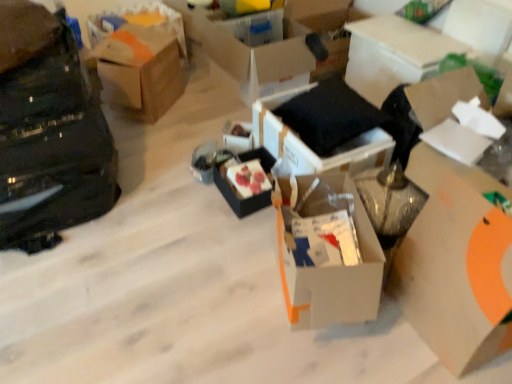
What do you see at coordinates (259, 54) in the screenshot?
I see `white cardboard box at upper center, which is the 3th box in left-to-right order` at bounding box center [259, 54].

The image size is (512, 384). In order to click on white cardboard box at upper center, the second box viewed from the right in this screenshot , I will do `click(393, 54)`.

How much space does brown cardboard box at upper left, positioned as the first box in left-to-right order, occupy horizontally?

It is 13.76 inches.

Identify the location of white cardboard box at center, the fifth box positioned from the right. This screenshot has width=512, height=384. (327, 252).

This screenshot has width=512, height=384. What do you see at coordinates (48, 132) in the screenshot?
I see `black matte bag at left` at bounding box center [48, 132].

The width and height of the screenshot is (512, 384). What are the coordinates of `white cardboard box at center, arranged as the 2th storage box when viewed from the back` in the screenshot? It's located at (237, 136).

From the image's perspective, is white cardboard box at center, the fifth box positioned from the right, on white cardboard box at center, which is the 2th storage box from front to back?

Actually, white cardboard box at center, the fifth box positioned from the right, appears below white cardboard box at center, which is the 2th storage box from front to back, in the image.

Considering the sizes of white cardboard box at center, which ranks as the fourth box in left-to-right order, and white cardboard box at center, the 3th storage box when ordered from top to bottom, in the image, is white cardboard box at center, which ranks as the fourth box in left-to-right order, wider or thinner than white cardboard box at center, the 3th storage box when ordered from top to bottom,?

Clearly, white cardboard box at center, which ranks as the fourth box in left-to-right order, has more width compared to white cardboard box at center, the 3th storage box when ordered from top to bottom.

Which is closer, (300,254) or (236,127)?

The point (300,254) is closer.

Would you say white cardboard box at upper right, which ranks as the eighth box in left-to-right order, is inside or outside black matte box at center, acting as the second box starting from the left?

white cardboard box at upper right, which ranks as the eighth box in left-to-right order, is spatially situated outside black matte box at center, acting as the second box starting from the left.

Considering the sizes of white cardboard box at upper right, which ranks as the eighth box in left-to-right order, and black matte box at center, acting as the second box starting from the left, in the image, is white cardboard box at upper right, which ranks as the eighth box in left-to-right order, taller or shorter than black matte box at center, acting as the second box starting from the left,?

Considering their sizes, white cardboard box at upper right, which ranks as the eighth box in left-to-right order, has more height than black matte box at center, acting as the second box starting from the left.

Is white cardboard box at upper right, which appears as the 1th box when viewed from the right, beside black matte box at center, acting as the second box starting from the left?

No, white cardboard box at upper right, which appears as the 1th box when viewed from the right, is not with black matte box at center, acting as the second box starting from the left.

Looking at this image, can you confirm if white cardboard box at upper right, which ranks as the third storage box in left-to-right order, is thinner than white cardboard box at center, which is the 1th storage box from bottom to top?

Indeed, white cardboard box at upper right, which ranks as the third storage box in left-to-right order, has a lesser width compared to white cardboard box at center, which is the 1th storage box from bottom to top.

Is white cardboard box at upper right, the 2th storage box positioned from the bottom, to the right of white cardboard box at center, which is the 1th storage box from bottom to top, from the viewer's perspective?

Correct, you'll find white cardboard box at upper right, the 2th storage box positioned from the bottom, to the right of white cardboard box at center, which is the 1th storage box from bottom to top.

Is white cardboard box at upper right, the 2th storage box positioned from the bottom, behind white cardboard box at center, arranged as the 2th storage box when viewed from the back?

No.

The image size is (512, 384). Find the location of `the 3rd box counting from the right of the black matte bag at left`. the 3rd box counting from the right of the black matte bag at left is located at coordinates (259, 54).

Does point (10, 36) come in front of point (241, 79)?

Yes, point (10, 36) is closer to viewer.

Does black matte bag at left appear on the left side of white cardboard box at upper center, placed as the sixth box when sorted from right to left?

Yes.

Which box is the 1st one when counting from the front of the white cardboard box at upper center, which is the 3th box in left-to-right order? Please provide its 2D coordinates.

[(141, 71)]

From a real-world perspective, which is physically below, white cardboard box at upper center, which is the 3th box in left-to-right order, or brown cardboard box at upper left, arranged as the eighth box when viewed from the right?

white cardboard box at upper center, which is the 3th box in left-to-right order, from a real-world perspective.

Can you confirm if white cardboard box at upper center, placed as the sixth box when sorted from right to left, is wider than brown cardboard box at upper left, positioned as the first box in left-to-right order?

Indeed, white cardboard box at upper center, placed as the sixth box when sorted from right to left, has a greater width compared to brown cardboard box at upper left, positioned as the first box in left-to-right order.

Is white cardboard box at upper center, placed as the sixth box when sorted from right to left, in front of or behind brown cardboard box at upper left, arranged as the eighth box when viewed from the right, in the image?

In the image, white cardboard box at upper center, placed as the sixth box when sorted from right to left, appears behind brown cardboard box at upper left, arranged as the eighth box when viewed from the right.

Is white cardboard box at upper center, the second box viewed from the right, inside or outside of white cardboard box at right, the third box in the right-to-left sequence?

white cardboard box at upper center, the second box viewed from the right, is located beyond the bounds of white cardboard box at right, the third box in the right-to-left sequence.

From the image's perspective, is white cardboard box at upper center, which ranks as the seventh box in left-to-right order, positioned above or below white cardboard box at right, the third box in the right-to-left sequence?

white cardboard box at upper center, which ranks as the seventh box in left-to-right order, is situated higher than white cardboard box at right, the third box in the right-to-left sequence, in the image.

From a real-world perspective, is white cardboard box at upper center, which ranks as the seventh box in left-to-right order, above or below white cardboard box at right, the third box in the right-to-left sequence?

Clearly, from a real-world perspective, white cardboard box at upper center, which ranks as the seventh box in left-to-right order, is below white cardboard box at right, the third box in the right-to-left sequence.

Considering the sizes of objects white cardboard box at upper center, the second box viewed from the right, and white cardboard box at right, acting as the sixth box starting from the left, in the image provided, who is shorter, white cardboard box at upper center, the second box viewed from the right, or white cardboard box at right, acting as the sixth box starting from the left,?

white cardboard box at upper center, the second box viewed from the right.

Measure the distance between white cardboard box at center, arranged as the 2th storage box when viewed from the back, and black fabric cushion at center, the 4th box in the right-to-left sequence.

They are 11.45 inches apart.

Is white cardboard box at center, which is the 2th storage box from front to back, aimed at black fabric cushion at center, which is the fifth box in left-to-right order?

No.

From the image's perspective, which is above, white cardboard box at center, which is the 2th storage box from front to back, or black fabric cushion at center, which is the fifth box in left-to-right order?

black fabric cushion at center, which is the fifth box in left-to-right order.

Considering the sizes of objects white cardboard box at center, which is the 1th storage box from bottom to top, and black fabric cushion at center, which is the fifth box in left-to-right order, in the image provided, who is taller, white cardboard box at center, which is the 1th storage box from bottom to top, or black fabric cushion at center, which is the fifth box in left-to-right order,?

Standing taller between the two is black fabric cushion at center, which is the fifth box in left-to-right order.

Locate an element on the screen. The width and height of the screenshot is (512, 384). box that is the 3rd object located below the white cardboard box at center, marked as the 2th storage box in a left-to-right arrangement (from the image's perspective) is located at coordinates (327, 252).

From a real-world perspective, count 7th boxs upward from the black matte box at center, the seventh box from the right, and point to it. Please provide its 2D coordinates.

[(453, 114)]

From the image, which object appears to be nearer to black matte bag at left, cardboard box at upper left, the 3th storage box ordered from the bottom, or brown cardboard box at upper left, arranged as the eighth box when viewed from the right?

brown cardboard box at upper left, arranged as the eighth box when viewed from the right, is closer to black matte bag at left.

Estimate the real-world distances between objects in this image. Which object is further from white cardboard box at upper center, placed as the sixth box when sorted from right to left, white cardboard box at center, arranged as the 2th storage box when viewed from the back, or white cardboard box at center, which ranks as the fourth box in left-to-right order?

white cardboard box at center, which ranks as the fourth box in left-to-right order, is positioned further to the anchor white cardboard box at upper center, placed as the sixth box when sorted from right to left.

Estimate the real-world distances between objects in this image. Which object is closer to white cardboard box at center, the second storage box from the right, white cardboard box at center, which ranks as the fourth box in left-to-right order, or white cardboard box at right, the third box in the right-to-left sequence?

white cardboard box at center, which ranks as the fourth box in left-to-right order, lies closer to white cardboard box at center, the second storage box from the right, than the other object.

Based on the photo, looking at the image, which one is located further to brown cardboard box at upper left, positioned as the first box in left-to-right order, black matte bag at left or white cardboard box at upper right, which is counted as the first storage box, starting from the front?

white cardboard box at upper right, which is counted as the first storage box, starting from the front, is further to brown cardboard box at upper left, positioned as the first box in left-to-right order.

Considering their positions, is cardboard box at upper left, the 3th storage box ordered from the bottom, positioned closer to white cardboard box at upper right, which ranks as the eighth box in left-to-right order, than white cardboard box at upper right, which ranks as the 1th storage box in right-to-left order?

Based on the image, white cardboard box at upper right, which ranks as the 1th storage box in right-to-left order, appears to be nearer to white cardboard box at upper right, which ranks as the eighth box in left-to-right order.

Considering their positions, is white cardboard box at right, acting as the sixth box starting from the left, positioned further to cardboard box at upper left, which is the 3th storage box in right-to-left order, than brown cardboard box at upper left, arranged as the eighth box when viewed from the right?

Based on the image, white cardboard box at right, acting as the sixth box starting from the left, appears to be further to cardboard box at upper left, which is the 3th storage box in right-to-left order.

When comparing their distances from white cardboard box at right, the third box in the right-to-left sequence, does white cardboard box at upper right, positioned as the 3th storage box in back-to-front order, or black matte box at center, acting as the second box starting from the left, seem further?

The object further to white cardboard box at right, the third box in the right-to-left sequence, is white cardboard box at upper right, positioned as the 3th storage box in back-to-front order.

Looking at the image, which one is located closer to black fabric cushion at center, which is the fifth box in left-to-right order, white cardboard box at right, acting as the sixth box starting from the left, or black matte box at center, acting as the second box starting from the left?

black matte box at center, acting as the second box starting from the left, is positioned closer to the anchor black fabric cushion at center, which is the fifth box in left-to-right order.

Identify the location of storage box between white cardboard box at upper right, which appears as the 1th box when viewed from the right, and white cardboard box at upper center, the second box viewed from the right, from front to back. (479, 26).

Find the location of a particular element. This screenshot has width=512, height=384. storage box between white cardboard box at upper center, placed as the sixth box when sorted from right to left, and black matte box at center, acting as the second box starting from the left, vertically is located at coordinates (237, 136).

Image resolution: width=512 pixels, height=384 pixels. I want to click on storage box between brown cardboard box at upper left, arranged as the eighth box when viewed from the right, and white cardboard box at upper right, positioned as the 3th storage box in back-to-front order, so click(x=237, y=136).

Where is `bag located between white cardboard box at center, the fifth box positioned from the right, and cardboard box at upper left, the 3th storage box ordered from the bottom, in the depth direction`? This screenshot has height=384, width=512. bag located between white cardboard box at center, the fifth box positioned from the right, and cardboard box at upper left, the 3th storage box ordered from the bottom, in the depth direction is located at coordinates (48, 132).